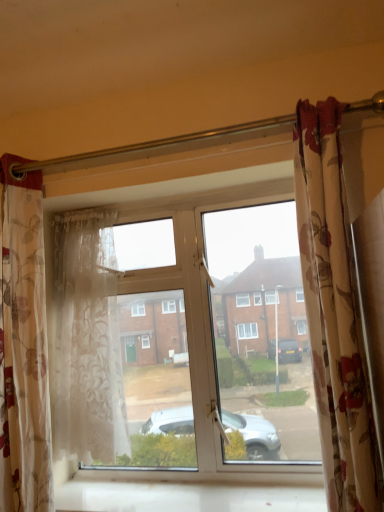
What do you see at coordinates (87, 340) in the screenshot?
I see `sheer floral fabric curtain at left, which ranks as the second curtain in left-to-right order` at bounding box center [87, 340].

At what (x,y) coordinates should I click in order to perform the action: click on white smooth window sill at lower center. Please return your answer as a coordinate pair (x, y). This screenshot has height=512, width=384. Looking at the image, I should click on (194, 490).

In the image, is translucent floral fabric curtain at left, placed as the 3th curtain when sorted from right to left, positioned in front of or behind transparent glass window at center?

Visually, translucent floral fabric curtain at left, placed as the 3th curtain when sorted from right to left, is located in front of transparent glass window at center.

Is point (13, 408) farther from camera compared to point (284, 286)?

No.

Is translucent floral fabric curtain at left, placed as the 3th curtain when sorted from right to left, shorter than transparent glass window at center?

No, translucent floral fabric curtain at left, placed as the 3th curtain when sorted from right to left, is not shorter than transparent glass window at center.

From the image's perspective, which one is positioned higher, translucent floral fabric curtain at left, acting as the first curtain starting from the left, or transparent glass window at center?

translucent floral fabric curtain at left, acting as the first curtain starting from the left, is shown above in the image.

Consider the image. Considering the relative sizes of translucent floral fabric curtain at left, placed as the 3th curtain when sorted from right to left, and floral fabric curtain at right, the first curtain viewed from the right, in the image provided, is translucent floral fabric curtain at left, placed as the 3th curtain when sorted from right to left, taller than floral fabric curtain at right, the first curtain viewed from the right,?

Yes.

Considering the relative positions of translucent floral fabric curtain at left, acting as the first curtain starting from the left, and floral fabric curtain at right, acting as the third curtain starting from the left, in the image provided, is translucent floral fabric curtain at left, acting as the first curtain starting from the left, to the left or to the right of floral fabric curtain at right, acting as the third curtain starting from the left,?

translucent floral fabric curtain at left, acting as the first curtain starting from the left, is to the left of floral fabric curtain at right, acting as the third curtain starting from the left.

From the image's perspective, which is above, translucent floral fabric curtain at left, placed as the 3th curtain when sorted from right to left, or floral fabric curtain at right, the first curtain viewed from the right?

floral fabric curtain at right, the first curtain viewed from the right, appears higher in the image.

From a real-world perspective, is translucent floral fabric curtain at left, acting as the first curtain starting from the left, over floral fabric curtain at right, the first curtain viewed from the right?

No, from a real-world perspective, translucent floral fabric curtain at left, acting as the first curtain starting from the left, is not above floral fabric curtain at right, the first curtain viewed from the right.

Can you confirm if transparent glass window at center is positioned to the left of floral fabric curtain at right, acting as the third curtain starting from the left?

Correct, you'll find transparent glass window at center to the left of floral fabric curtain at right, acting as the third curtain starting from the left.

The image size is (384, 512). What are the coordinates of `window behind the floral fabric curtain at right, the first curtain viewed from the right` in the screenshot? It's located at (178, 339).

Can you confirm if transparent glass window at center is bigger than floral fabric curtain at right, acting as the third curtain starting from the left?

Yes, transparent glass window at center is bigger than floral fabric curtain at right, acting as the third curtain starting from the left.

Is white smooth window sill at lower center turned away from sheer floral fabric curtain at left, which ranks as the second curtain in left-to-right order?

white smooth window sill at lower center is not turned away from sheer floral fabric curtain at left, which ranks as the second curtain in left-to-right order.

Consider the image. Can you confirm if white smooth window sill at lower center is shorter than sheer floral fabric curtain at left, which is the second curtain in right-to-left order?

Correct, white smooth window sill at lower center is not as tall as sheer floral fabric curtain at left, which is the second curtain in right-to-left order.

Is white smooth window sill at lower center in front of sheer floral fabric curtain at left, which ranks as the second curtain in left-to-right order?

Yes.

How many degrees apart are the facing directions of white smooth window sill at lower center and sheer floral fabric curtain at left, which ranks as the second curtain in left-to-right order?

There is a 1.24-degree angle between the facing directions of white smooth window sill at lower center and sheer floral fabric curtain at left, which ranks as the second curtain in left-to-right order.

Who is taller, transparent glass window at center or sheer floral fabric curtain at left, which ranks as the second curtain in left-to-right order?

Standing taller between the two is transparent glass window at center.

Between point (205, 214) and point (56, 332), which one is positioned in front?

Point (56, 332)

In the scene shown: From a real-world perspective, who is located higher, transparent glass window at center or sheer floral fabric curtain at left, which ranks as the second curtain in left-to-right order?

In real-world perspective, sheer floral fabric curtain at left, which ranks as the second curtain in left-to-right order, is above.

The width and height of the screenshot is (384, 512). I want to click on window sill on the right of the transparent glass window at center, so click(x=194, y=490).

How different are the orientations of transparent glass window at center and white smooth window sill at lower center in degrees?

0.00143 degrees.

Is transparent glass window at center far away from white smooth window sill at lower center?

No.

Is transparent glass window at center turned away from white smooth window sill at lower center?

No.

Can you tell me how much sheer floral fabric curtain at left, which ranks as the second curtain in left-to-right order, and translucent floral fabric curtain at left, acting as the first curtain starting from the left, differ in facing direction?

0.261 degrees separate the facing orientations of sheer floral fabric curtain at left, which ranks as the second curtain in left-to-right order, and translucent floral fabric curtain at left, acting as the first curtain starting from the left.

Is sheer floral fabric curtain at left, which is the second curtain in right-to-left order, at the left side of translucent floral fabric curtain at left, acting as the first curtain starting from the left?

No.

Is sheer floral fabric curtain at left, which is the second curtain in right-to-left order, located outside translucent floral fabric curtain at left, acting as the first curtain starting from the left?

That's correct, sheer floral fabric curtain at left, which is the second curtain in right-to-left order, is outside of translucent floral fabric curtain at left, acting as the first curtain starting from the left.

Where is `window that is under the translucent floral fabric curtain at left, acting as the first curtain starting from the left (from a real-world perspective)`? The height and width of the screenshot is (512, 384). window that is under the translucent floral fabric curtain at left, acting as the first curtain starting from the left (from a real-world perspective) is located at coordinates (178, 339).

Where is `curtain above the translucent floral fabric curtain at left, acting as the first curtain starting from the left (from a real-world perspective)`? Image resolution: width=384 pixels, height=512 pixels. curtain above the translucent floral fabric curtain at left, acting as the first curtain starting from the left (from a real-world perspective) is located at coordinates (334, 313).

Considering their positions, is sheer floral fabric curtain at left, which ranks as the second curtain in left-to-right order, positioned closer to translucent floral fabric curtain at left, acting as the first curtain starting from the left, than floral fabric curtain at right, the first curtain viewed from the right?

sheer floral fabric curtain at left, which ranks as the second curtain in left-to-right order, is closer to translucent floral fabric curtain at left, acting as the first curtain starting from the left.

Looking at this image, from the image, which object appears to be farther from white smooth window sill at lower center, transparent glass window at center or sheer floral fabric curtain at left, which is the second curtain in right-to-left order?

sheer floral fabric curtain at left, which is the second curtain in right-to-left order.

From the image, which object appears to be nearer to sheer floral fabric curtain at left, which is the second curtain in right-to-left order, transparent glass window at center or floral fabric curtain at right, acting as the third curtain starting from the left?

transparent glass window at center is closer to sheer floral fabric curtain at left, which is the second curtain in right-to-left order.

Considering their positions, is transparent glass window at center positioned closer to translucent floral fabric curtain at left, placed as the 3th curtain when sorted from right to left, than floral fabric curtain at right, the first curtain viewed from the right?

Based on the image, transparent glass window at center appears to be nearer to translucent floral fabric curtain at left, placed as the 3th curtain when sorted from right to left.

From the image, which object appears to be nearer to white smooth window sill at lower center, transparent glass window at center or floral fabric curtain at right, acting as the third curtain starting from the left?

transparent glass window at center.

Based on their spatial positions, is white smooth window sill at lower center or floral fabric curtain at right, acting as the third curtain starting from the left, further from sheer floral fabric curtain at left, which ranks as the second curtain in left-to-right order?

floral fabric curtain at right, acting as the third curtain starting from the left, is positioned further to the anchor sheer floral fabric curtain at left, which ranks as the second curtain in left-to-right order.

Considering their positions, is white smooth window sill at lower center positioned further to translucent floral fabric curtain at left, acting as the first curtain starting from the left, than floral fabric curtain at right, acting as the third curtain starting from the left?

The object further to translucent floral fabric curtain at left, acting as the first curtain starting from the left, is floral fabric curtain at right, acting as the third curtain starting from the left.

From the picture: From the image, which object appears to be nearer to sheer floral fabric curtain at left, which ranks as the second curtain in left-to-right order, white smooth window sill at lower center or translucent floral fabric curtain at left, acting as the first curtain starting from the left?

The object closer to sheer floral fabric curtain at left, which ranks as the second curtain in left-to-right order, is translucent floral fabric curtain at left, acting as the first curtain starting from the left.

Locate an element on the screen. window sill between translucent floral fabric curtain at left, placed as the 3th curtain when sorted from right to left, and floral fabric curtain at right, the first curtain viewed from the right, from left to right is located at coordinates (194, 490).

Locate an element on the screen. curtain between translucent floral fabric curtain at left, placed as the 3th curtain when sorted from right to left, and white smooth window sill at lower center in the up-down direction is located at coordinates (87, 340).

At what (x,y) coordinates should I click in order to perform the action: click on window between translucent floral fabric curtain at left, acting as the first curtain starting from the left, and floral fabric curtain at right, the first curtain viewed from the right, in the horizontal direction. Please return your answer as a coordinate pair (x, y). This screenshot has width=384, height=512. Looking at the image, I should click on (178, 339).

At what (x,y) coordinates should I click in order to perform the action: click on window located between sheer floral fabric curtain at left, which ranks as the second curtain in left-to-right order, and floral fabric curtain at right, acting as the third curtain starting from the left, in the left-right direction. Please return your answer as a coordinate pair (x, y). The image size is (384, 512). Looking at the image, I should click on (178, 339).